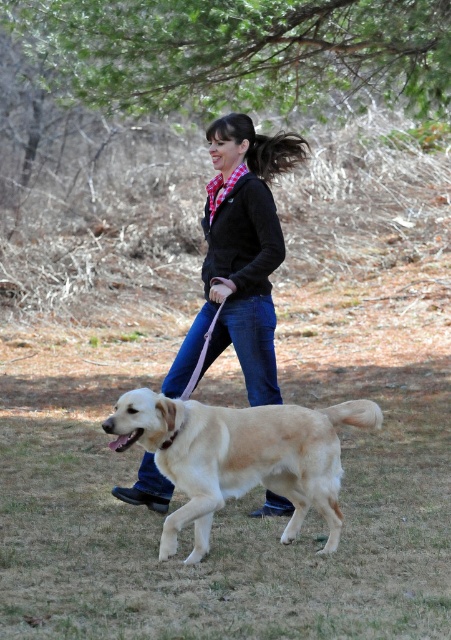
Question: Which object appears closest to the camera in this image?

Choices:
 (A) golden fur dog at center
 (B) matte black jacket at center

Answer: (A)

Question: Is golden fur dog at center to the left of matte black jacket at center from the viewer's perspective?

Choices:
 (A) no
 (B) yes

Answer: (B)

Question: Among these points, which one is nearest to the camera?

Choices:
 (A) (258, 170)
 (B) (175, 545)

Answer: (B)

Question: Observing the image, what is the correct spatial positioning of golden fur dog at center in reference to matte black jacket at center?

Choices:
 (A) left
 (B) right

Answer: (A)

Question: Is the position of golden fur dog at center more distant than that of matte black jacket at center?

Choices:
 (A) no
 (B) yes

Answer: (A)